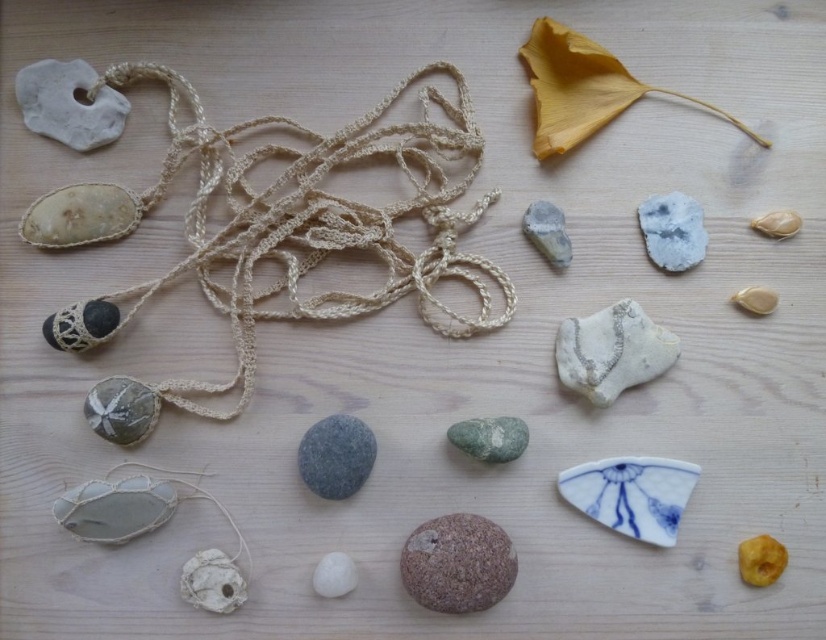
Question: Among these objects, which one is nearest to the camera?

Choices:
 (A) smooth gray stone at center
 (B) gray matte stone at center

Answer: (A)

Question: Which of the following is the closest to the observer?

Choices:
 (A) green smooth rock at center
 (B) matte beige seashell at upper right
 (C) white matte rock at upper right

Answer: (B)

Question: Can you confirm if white matte rock at upper right is positioned to the left of translucent amber stone at lower right?

Choices:
 (A) yes
 (B) no

Answer: (A)

Question: Based on their relative distances, which object is farther from the smooth gray stone at center?

Choices:
 (A) gray matte stone at center
 (B) green smooth rock at center
 (C) matte beige seashell at upper right
 (D) brown rough stone at center

Answer: (C)

Question: From the image, what is the correct spatial relationship of smooth gray stone at center in relation to gray matte rock at center?

Choices:
 (A) left
 (B) right

Answer: (A)

Question: Does gray matte rock at center appear on the left side of yellow rubber ball at lower right?

Choices:
 (A) no
 (B) yes

Answer: (B)